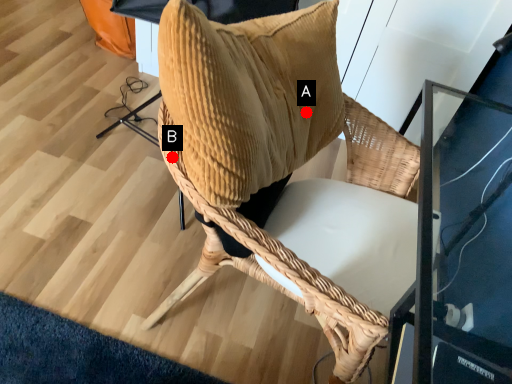
Question: Two points are circled on the image, labeled by A and B beside each circle. Which of the following is the farthest from the observer?

Choices:
 (A) A is further
 (B) B is further

Answer: (A)